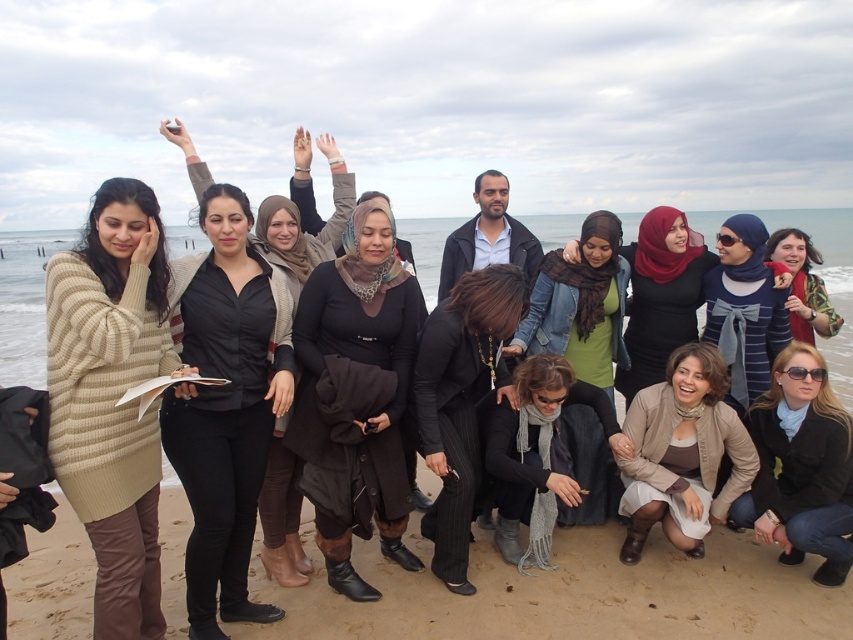
Is point (213, 221) farther from viewer compared to point (646, 228)?

No, it is in front of (646, 228).

Between black matte shirt at center and matte black hijab at center, which one is positioned higher?

matte black hijab at center is above.

This screenshot has height=640, width=853. I want to click on black matte shirt at center, so click(x=225, y=412).

Does black matte coat at center have a lesser height compared to black pinstripe pants at center?

No.

What do you see at coordinates (357, 396) in the screenshot?
I see `black matte coat at center` at bounding box center [357, 396].

What do you see at coordinates (357, 396) in the screenshot? The width and height of the screenshot is (853, 640). I see `black matte coat at center` at bounding box center [357, 396].

Find the location of a particular element. This screenshot has width=853, height=640. black matte coat at center is located at coordinates (357, 396).

Which is behind, point (764, 506) or point (689, 236)?

The point (689, 236) is more distant.

Between sunglasses fabric scarf at lower right and matte black hijab at center, which one is positioned higher?

matte black hijab at center is above.

Does point (786, 408) come closer to viewer compared to point (630, 397)?

Yes, it is.

Where is `sunglasses fabric scarf at lower right`? Image resolution: width=853 pixels, height=640 pixels. sunglasses fabric scarf at lower right is located at coordinates (801, 467).